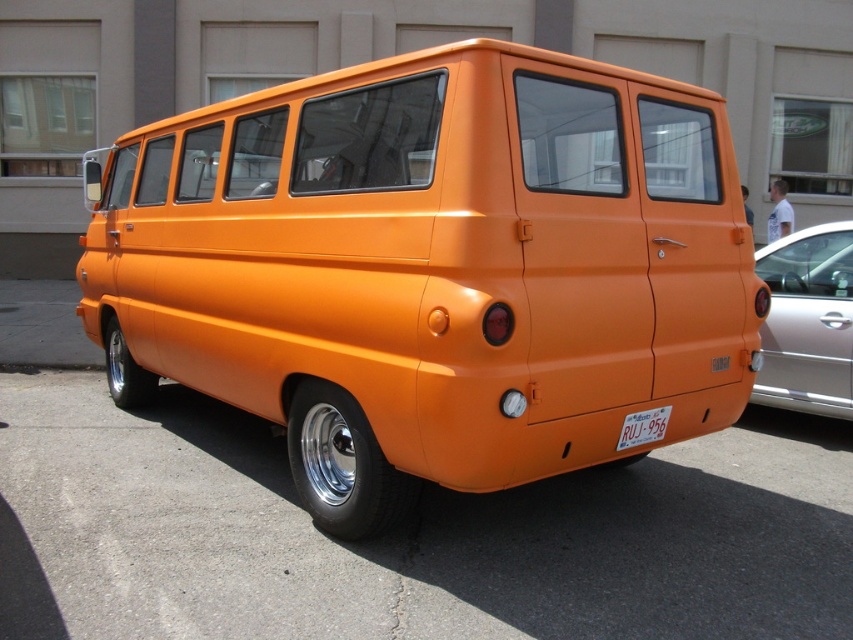
Between orange matte van at center and white plastic license plate at lower center, which one has more height?

white plastic license plate at lower center

Can you confirm if orange matte van at center is wider than white plastic license plate at lower center?

Indeed, orange matte van at center has a greater width compared to white plastic license plate at lower center.

Which is behind, point (434, 506) or point (625, 424)?

The point (434, 506) is behind.

At what (x,y) coordinates should I click in order to perform the action: click on orange matte van at center. Please return your answer as a coordinate pair (x, y). Looking at the image, I should click on (404, 536).

Between point (701, 320) and point (15, 420), which one is positioned behind?

Positioned behind is point (15, 420).

The height and width of the screenshot is (640, 853). Describe the element at coordinates (432, 268) in the screenshot. I see `matte orange van at center` at that location.

Is point (395, 157) less distant than point (727, 600)?

No, it is not.

Locate an element on the screen. This screenshot has width=853, height=640. matte orange van at center is located at coordinates [432, 268].

Can you confirm if matte orange van at center is taller than white plastic license plate at lower center?

Yes, matte orange van at center is taller than white plastic license plate at lower center.

Between point (108, 163) and point (633, 429), which one is positioned behind?

The point (108, 163) is behind.

At what (x,y) coordinates should I click in order to perform the action: click on matte orange van at center. Please return your answer as a coordinate pair (x, y). Looking at the image, I should click on (432, 268).